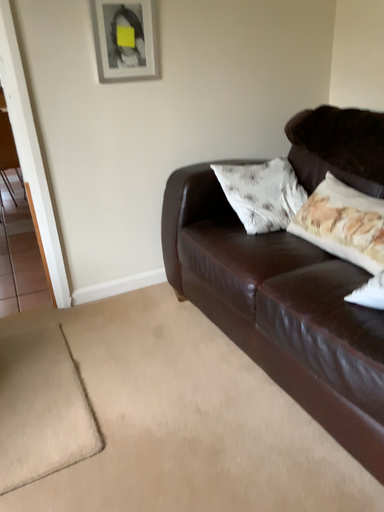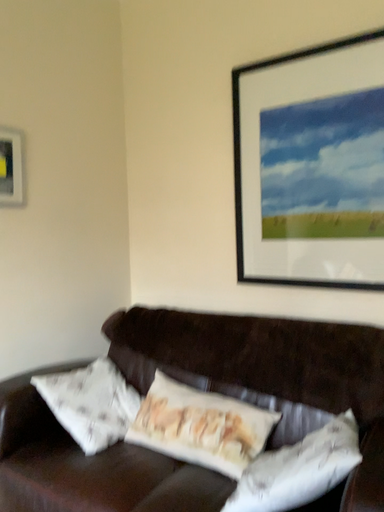
Question: How did the camera likely rotate when shooting the video?

Choices:
 (A) rotated downward
 (B) rotated upward

Answer: (B)